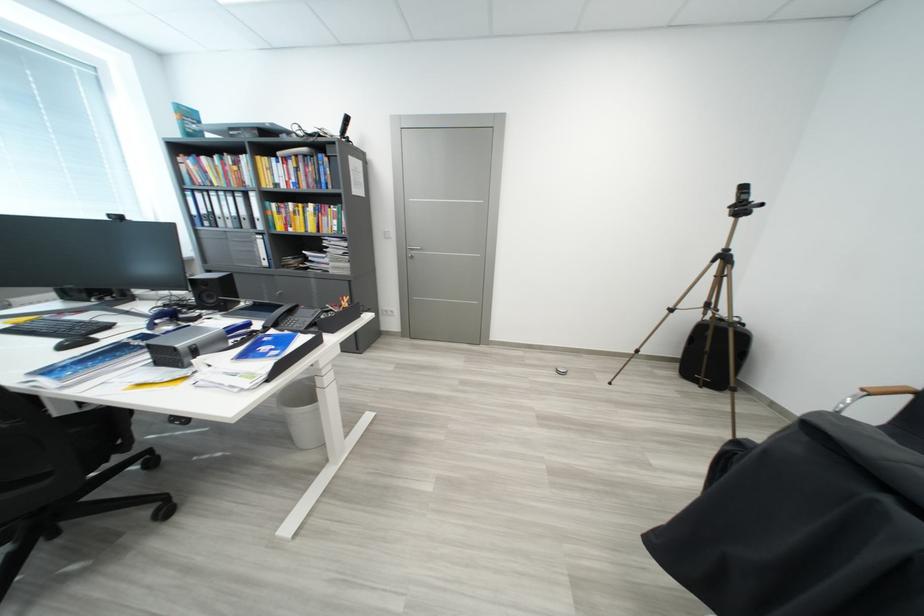
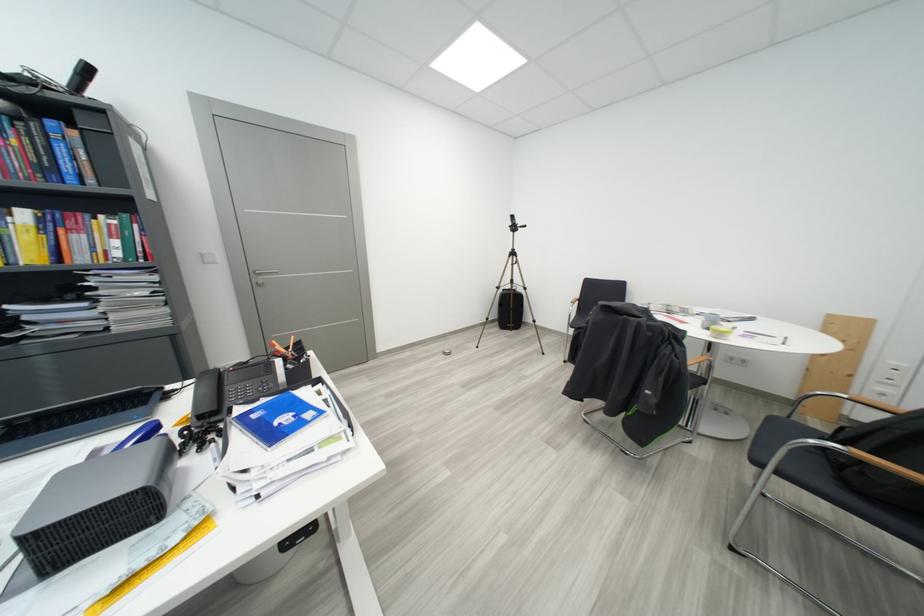
In the second image, find the point that corresponds to the point at 344,225 in the first image.

(126, 245)